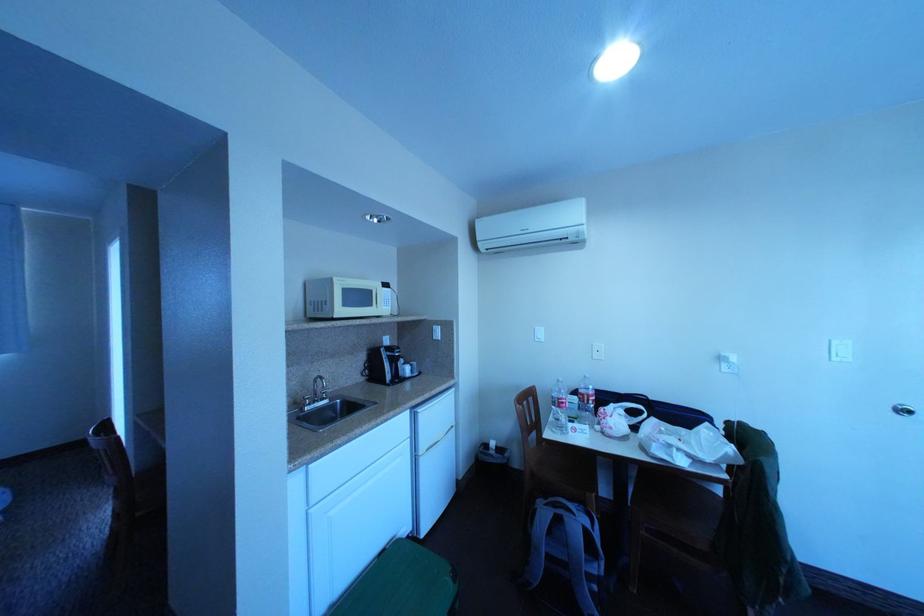
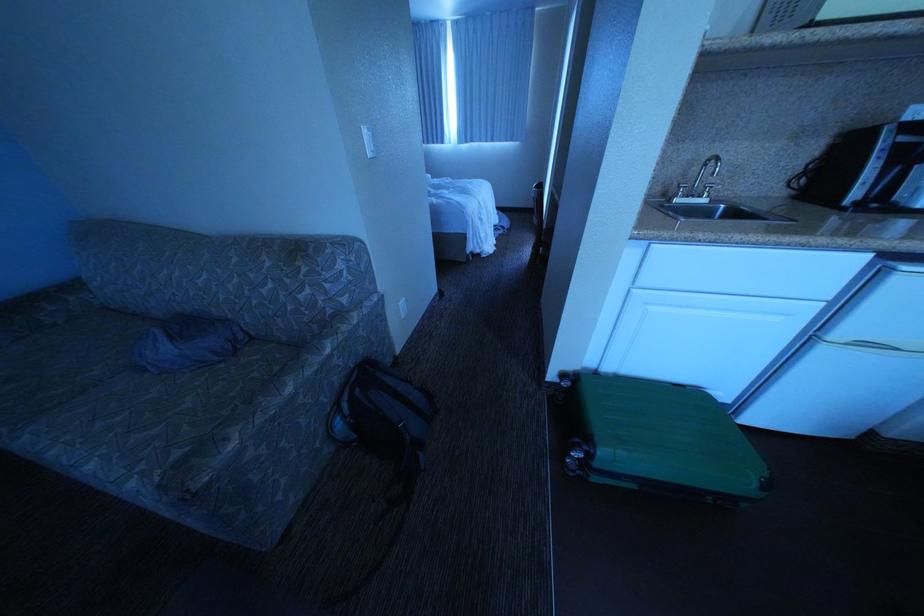
How did the camera likely rotate?

The camera's rotation is toward left-down.